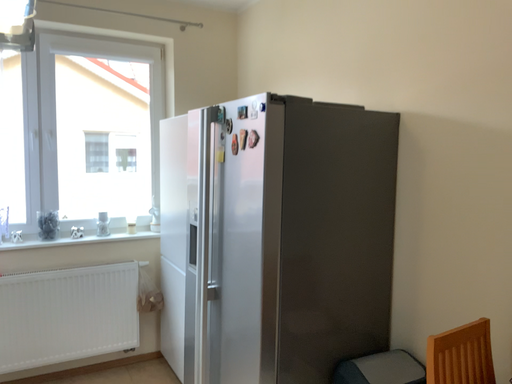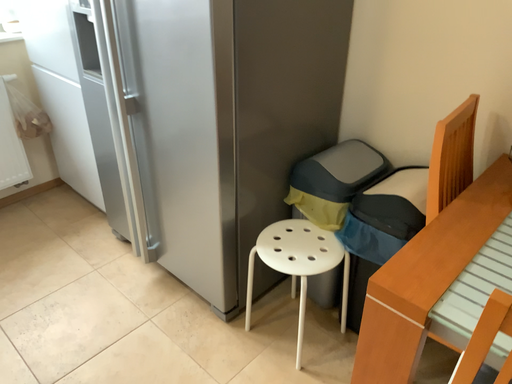
Question: How did the camera likely rotate when shooting the video?

Choices:
 (A) rotated right
 (B) rotated left

Answer: (A)